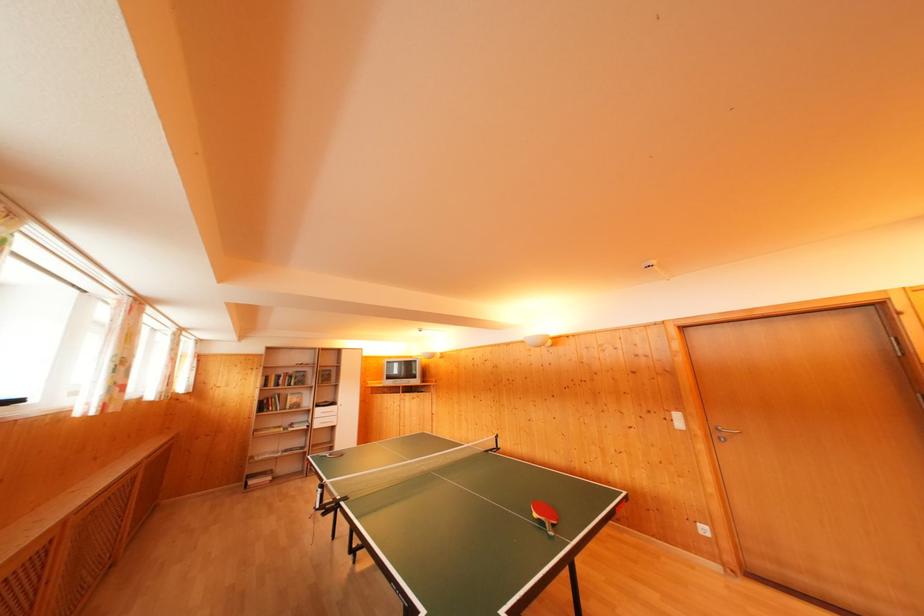
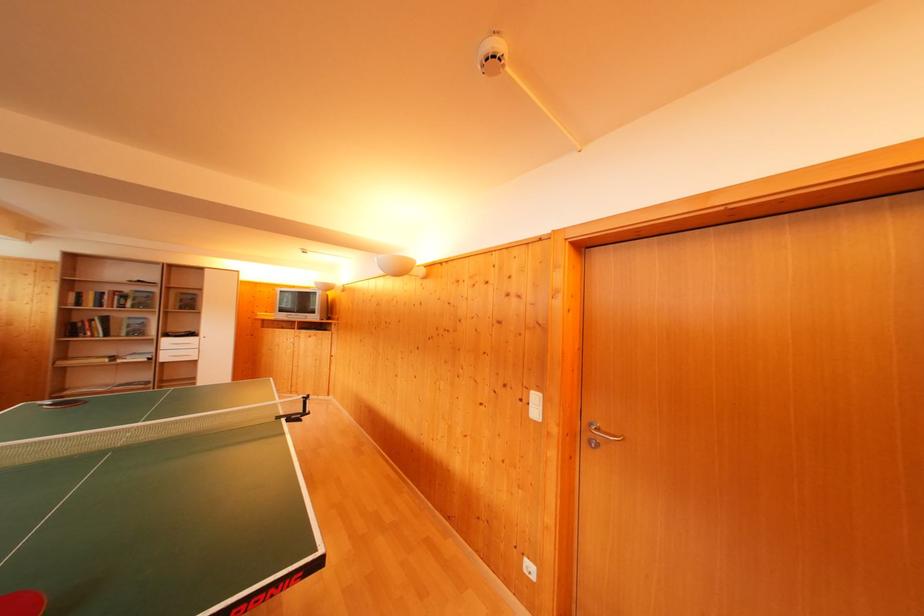
The point at (x=296, y=376) is marked in the first image. Where is the corresponding point in the second image?

(131, 294)